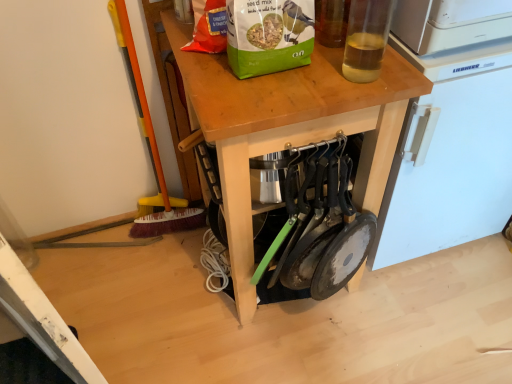
In order to click on wooden at center in this screenshot , I will do `click(290, 127)`.

Measure the distance between point (322, 132) and camera.

A distance of 38.07 inches exists between point (322, 132) and camera.

This screenshot has width=512, height=384. I want to click on translucent glass bottle at upper right, so click(366, 39).

What do you see at coordinates (450, 130) in the screenshot? This screenshot has height=384, width=512. I see `white plastic refrigerator at upper right` at bounding box center [450, 130].

What do you see at coordinates (268, 35) in the screenshot? This screenshot has width=512, height=384. I see `green matte paper bag at upper center` at bounding box center [268, 35].

What do you see at coordinates (141, 111) in the screenshot?
I see `orange plastic brush at left` at bounding box center [141, 111].

The height and width of the screenshot is (384, 512). I want to click on wooden at center, so pos(290,127).

Is point (293, 38) positioned in front of point (225, 78)?

Yes, it is.

From a real-world perspective, is green matte paper bag at upper center positioned above or below wooden at center?

green matte paper bag at upper center is above wooden at center.

How far apart are green matte paper bag at upper center and wooden at center?

A distance of 7.27 inches exists between green matte paper bag at upper center and wooden at center.

From a real-world perspective, is green matte paper bag at upper center beneath translucent glass bottle at upper right?

Yes, from a real-world perspective, green matte paper bag at upper center is beneath translucent glass bottle at upper right.

Considering the sizes of objects green matte paper bag at upper center and translucent glass bottle at upper right in the image provided, who is taller, green matte paper bag at upper center or translucent glass bottle at upper right?

translucent glass bottle at upper right is taller.

Does green matte paper bag at upper center touch translucent glass bottle at upper right?

No, green matte paper bag at upper center is not with translucent glass bottle at upper right.

Considering the sizes of objects green matte paper bag at upper center and translucent glass bottle at upper right in the image provided, who is wider, green matte paper bag at upper center or translucent glass bottle at upper right?

green matte paper bag at upper center is wider.

Is the depth of white plastic refrigerator at upper right less than that of green matte paper bag at upper center?

No, white plastic refrigerator at upper right is behind green matte paper bag at upper center.

From a real-world perspective, does white plastic refrigerator at upper right sit lower than green matte paper bag at upper center?

Yes, from a real-world perspective, white plastic refrigerator at upper right is beneath green matte paper bag at upper center.

Locate an element on the screen. paper bag that is above the white plastic refrigerator at upper right (from the image's perspective) is located at coordinates click(268, 35).

Considering the points (500, 14) and (265, 3), which point is behind, point (500, 14) or point (265, 3)?

The point (500, 14) is more distant.

Between orange plastic brush at left and wooden at center, which one has more height?

orange plastic brush at left.

Can you tell me how much orange plastic brush at left and wooden at center differ in facing direction?

orange plastic brush at left and wooden at center are facing 13.4 degrees away from each other.

From a real-world perspective, who is located higher, orange plastic brush at left or wooden at center?

From a 3D spatial view, orange plastic brush at left is above.

Considering the positions of objects orange plastic brush at left and wooden at center in the image provided, who is more to the left, orange plastic brush at left or wooden at center?

orange plastic brush at left.

Identify the location of bottle lying on the right of green matte paper bag at upper center. (366, 39).

Based on their sizes in the image, would you say translucent glass bottle at upper right is bigger or smaller than green matte paper bag at upper center?

Considering their sizes, translucent glass bottle at upper right takes up less space than green matte paper bag at upper center.

Is translucent glass bottle at upper right further to the viewer compared to green matte paper bag at upper center?

No.

From a real-world perspective, which object stands above the other?

translucent glass bottle at upper right, from a real-world perspective.

In the scene shown: How different are the orientations of wooden at center and green matte paper bag at upper center in degrees?

The angle between the facing direction of wooden at center and the facing direction of green matte paper bag at upper center is 0.651 degrees.

From a real-world perspective, is wooden at center physically above green matte paper bag at upper center?

No, from a real-world perspective, wooden at center is not above green matte paper bag at upper center.

In the scene shown: Considering the sizes of objects wooden at center and green matte paper bag at upper center in the image provided, who is shorter, wooden at center or green matte paper bag at upper center?

Standing shorter between the two is green matte paper bag at upper center.

Is wooden at center located outside green matte paper bag at upper center?

Yes, wooden at center is not within green matte paper bag at upper center.

Is wooden at center aimed at white plastic refrigerator at upper right?

No, wooden at center is not oriented towards white plastic refrigerator at upper right.

Is wooden at center positioned far away from white plastic refrigerator at upper right?

No, wooden at center is not far away from white plastic refrigerator at upper right.

Which object is further away from the camera, wooden at center or white plastic refrigerator at upper right?

white plastic refrigerator at upper right is more distant.

Looking at this image, can we say wooden at center lies outside white plastic refrigerator at upper right?

Absolutely, wooden at center is external to white plastic refrigerator at upper right.

This screenshot has height=384, width=512. What are the coordinates of `paper bag that appears in front of the wooden at center` in the screenshot? It's located at click(268, 35).

This screenshot has width=512, height=384. Find the location of `bottle on the right of green matte paper bag at upper center`. bottle on the right of green matte paper bag at upper center is located at coordinates (366, 39).

When comparing their distances from green matte paper bag at upper center, does orange plastic brush at left or white plastic refrigerator at upper right seem further?

Based on the image, orange plastic brush at left appears to be further to green matte paper bag at upper center.

When comparing their distances from translucent glass bottle at upper right, does white plastic refrigerator at upper right or wooden at center seem further?

white plastic refrigerator at upper right is further to translucent glass bottle at upper right.

From the image, which object appears to be nearer to translucent glass bottle at upper right, green matte paper bag at upper center or orange plastic brush at left?

Among the two, green matte paper bag at upper center is located nearer to translucent glass bottle at upper right.

Considering their positions, is wooden at center positioned further to translucent glass bottle at upper right than orange plastic brush at left?

Based on the image, orange plastic brush at left appears to be further to translucent glass bottle at upper right.

Considering their positions, is wooden at center positioned closer to orange plastic brush at left than white plastic refrigerator at upper right?

wooden at center is closer to orange plastic brush at left.

Looking at the image, which one is located further to white plastic refrigerator at upper right, green matte paper bag at upper center or wooden at center?

Based on the image, green matte paper bag at upper center appears to be further to white plastic refrigerator at upper right.

From the image, which object appears to be farther from orange plastic brush at left, translucent glass bottle at upper right or wooden at center?

translucent glass bottle at upper right lies further to orange plastic brush at left than the other object.

From the image, which object appears to be nearer to white plastic refrigerator at upper right, orange plastic brush at left or translucent glass bottle at upper right?

translucent glass bottle at upper right is closer to white plastic refrigerator at upper right.

This screenshot has height=384, width=512. In order to click on bottle between green matte paper bag at upper center and white plastic refrigerator at upper right in this screenshot , I will do `click(366, 39)`.

Find the location of a particular element. bottle between wooden at center and white plastic refrigerator at upper right in the horizontal direction is located at coordinates (366, 39).

Find the location of a particular element. bottle located between orange plastic brush at left and white plastic refrigerator at upper right in the left-right direction is located at coordinates (366, 39).

Find the location of a particular element. paper bag situated between orange plastic brush at left and translucent glass bottle at upper right from left to right is located at coordinates (268, 35).